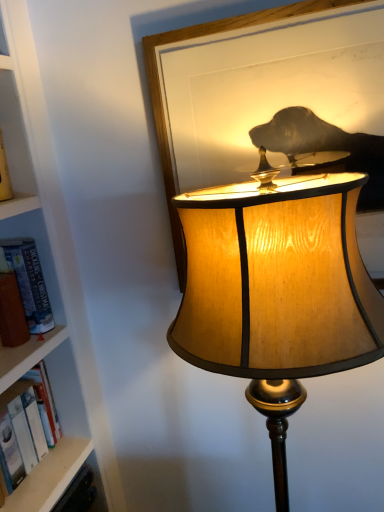
Question: Could you tell me if hardcover book at left is facing wooden lampshade at center?

Choices:
 (A) yes
 (B) no

Answer: (B)

Question: Is hardcover book at left at the left side of wooden lampshade at center?

Choices:
 (A) no
 (B) yes

Answer: (B)

Question: Is hardcover book at left thinner than wooden lampshade at center?

Choices:
 (A) no
 (B) yes

Answer: (B)

Question: Is the position of hardcover book at left more distant than that of wooden lampshade at center?

Choices:
 (A) yes
 (B) no

Answer: (A)

Question: From the image's perspective, is hardcover book at left on wooden lampshade at center?

Choices:
 (A) no
 (B) yes

Answer: (B)

Question: Can you see hardcover book at left touching wooden lampshade at center?

Choices:
 (A) no
 (B) yes

Answer: (A)

Question: Would you say wooden frame at upper center is a long distance from hardcover book at left?

Choices:
 (A) yes
 (B) no

Answer: (B)

Question: Considering the relative sizes of wooden frame at upper center and hardcover book at left in the image provided, is wooden frame at upper center thinner than hardcover book at left?

Choices:
 (A) no
 (B) yes

Answer: (B)

Question: Can you confirm if wooden frame at upper center is bigger than hardcover book at left?

Choices:
 (A) no
 (B) yes

Answer: (B)

Question: Is wooden frame at upper center not inside hardcover book at left?

Choices:
 (A) no
 (B) yes

Answer: (B)

Question: Is wooden frame at upper center taller than hardcover book at left?

Choices:
 (A) yes
 (B) no

Answer: (A)

Question: From the image's perspective, would you say wooden frame at upper center is shown under hardcover book at left?

Choices:
 (A) no
 (B) yes

Answer: (A)

Question: Could you tell me if wooden lampshade at center is facing hardcover book at left?

Choices:
 (A) no
 (B) yes

Answer: (A)